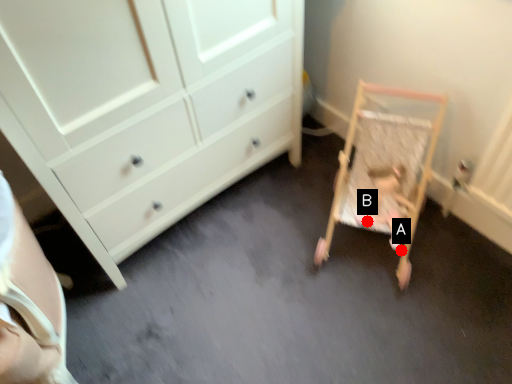
Question: Two points are circled on the image, labeled by A and B beside each circle. Which point is closer to the camera?

Choices:
 (A) A is closer
 (B) B is closer

Answer: (B)